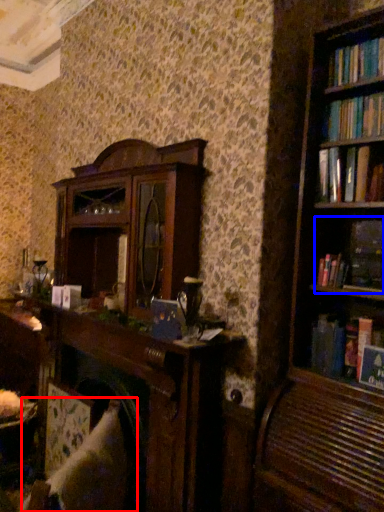
Question: Which object appears closest to the camera in this image, swivel chair (highlighted by a red box) or book (highlighted by a blue box)?

Choices:
 (A) swivel chair
 (B) book

Answer: (A)